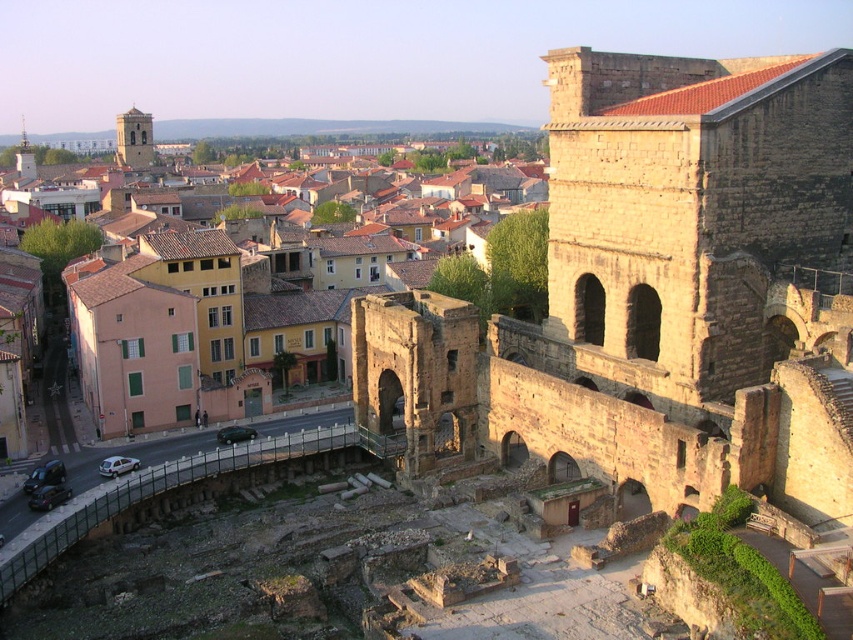
Is brown stone ruins at upper right bigger than brown stone tower at upper left?

No.

The width and height of the screenshot is (853, 640). In order to click on brown stone ruins at upper right in this screenshot , I will do `click(656, 296)`.

Where is `brown stone ruins at upper right`? This screenshot has width=853, height=640. brown stone ruins at upper right is located at coordinates (656, 296).

Consider the image. Which is below, brown stone ruins at upper right or yellow stucco buildings at center?

brown stone ruins at upper right is below.

Can you confirm if brown stone ruins at upper right is positioned to the left of yellow stucco buildings at center?

No, brown stone ruins at upper right is not to the left of yellow stucco buildings at center.

Does point (646, 109) lie in front of point (265, 388)?

That is True.

This screenshot has height=640, width=853. What are the coordinates of `brown stone ruins at upper right` in the screenshot? It's located at (x=656, y=296).

Is point (338, 360) positioned in front of point (126, 112)?

Yes, it is.

Between point (184, 296) and point (149, 156), which one is positioned behind?

The point (149, 156) is behind.

Between point (373, 176) and point (151, 131), which one is positioned in front?

Positioned in front is point (373, 176).

At what (x,y) coordinates should I click in order to perform the action: click on yellow stucco buildings at center. Please return your answer as a coordinate pair (x, y). Looking at the image, I should click on (186, 333).